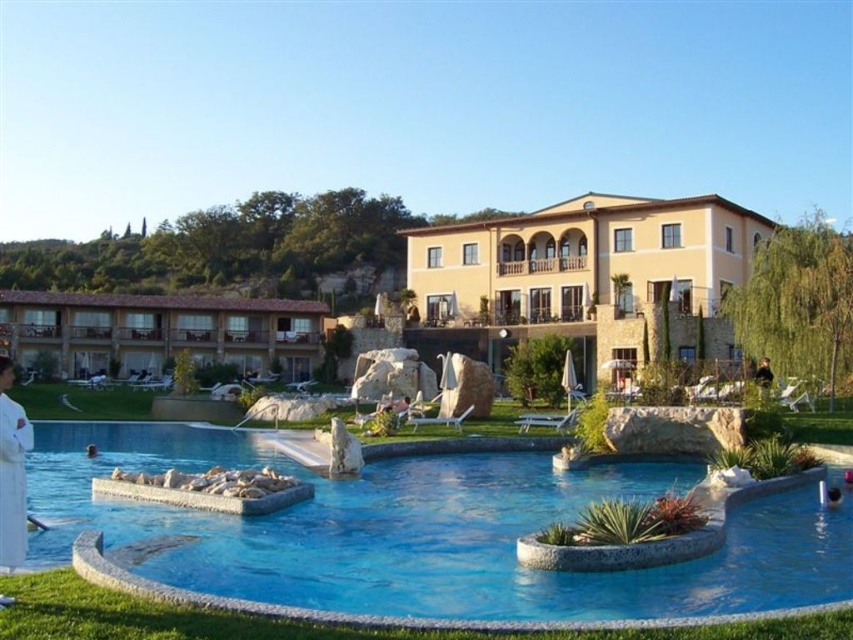
You are a guest staying at the resort and want to take a photo of both the beige stucco building at center and the brown tile roof resort at left from the pool area. Can you see both buildings in your camera frame without moving your position?

Yes, the beige stucco building at center is in front of the brown tile roof resort at left, so you can see both in the frame with the beige stucco building closer to the foreground and the brown tile roof resort at left slightly behind it.

In the scene shown: You are a guest staying at the resort and want to swim in the blue stone pool at center. The resort requires guests to stay at least 50 meters away from the beige stucco building at center for safety reasons. Can you safely swim in the pool?

The blue stone pool at center is 44.34 meters away from the beige stucco building at center. Since this distance is less than the required 50 meters, you cannot safely swim in the pool as it does not meet the safety distance requirement.